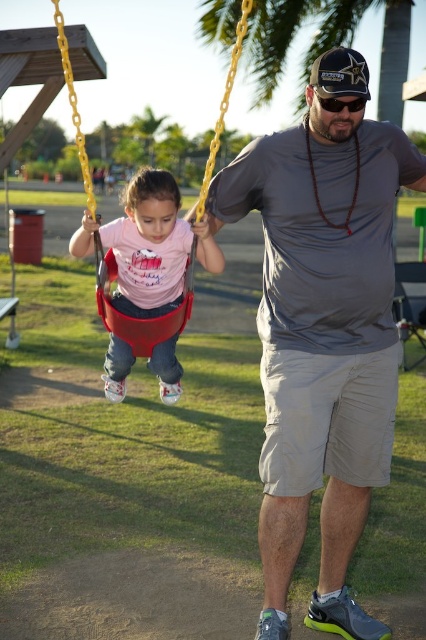
What is the color of the swing located at the coordinates point (140,317)?

The swing at point (140,317) is red.

You are a visitor at the park and notice the red plastic swing at left and the black plastic goggles at upper center. Which object is positioned higher from the ground?

The red plastic swing at left is positioned higher from the ground than the black plastic goggles at upper center because it is above it.